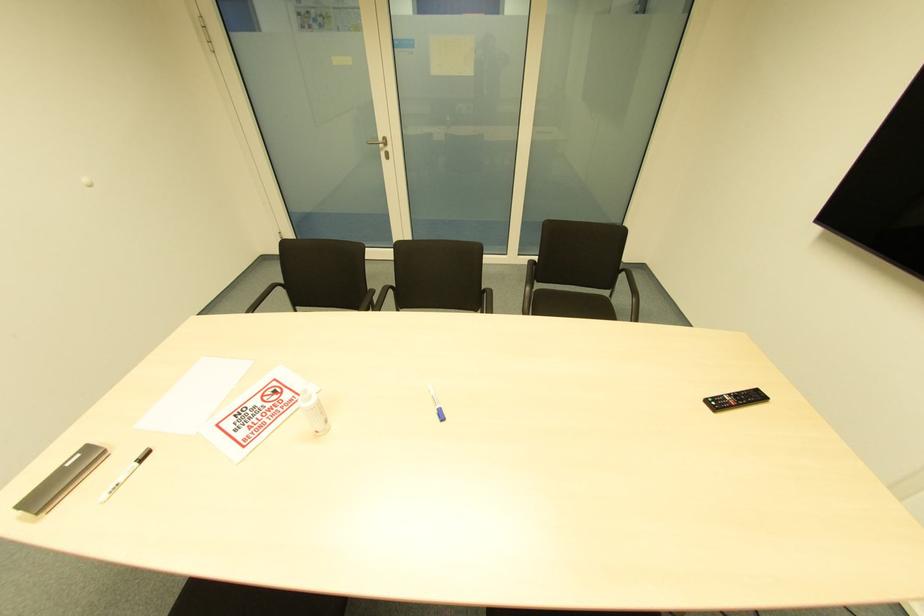
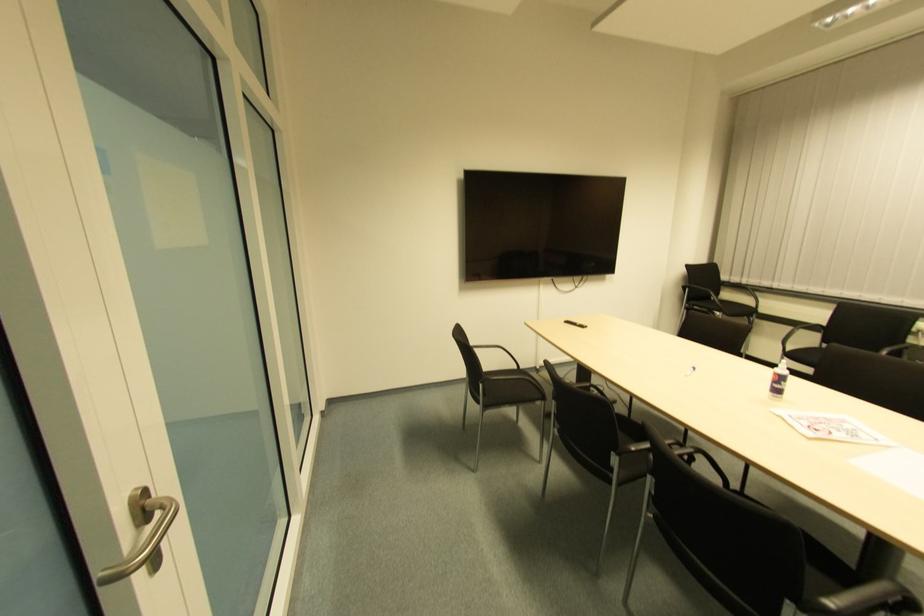
Where in the second image is the point corresponding to the point at 440,421 from the first image?

(691, 371)